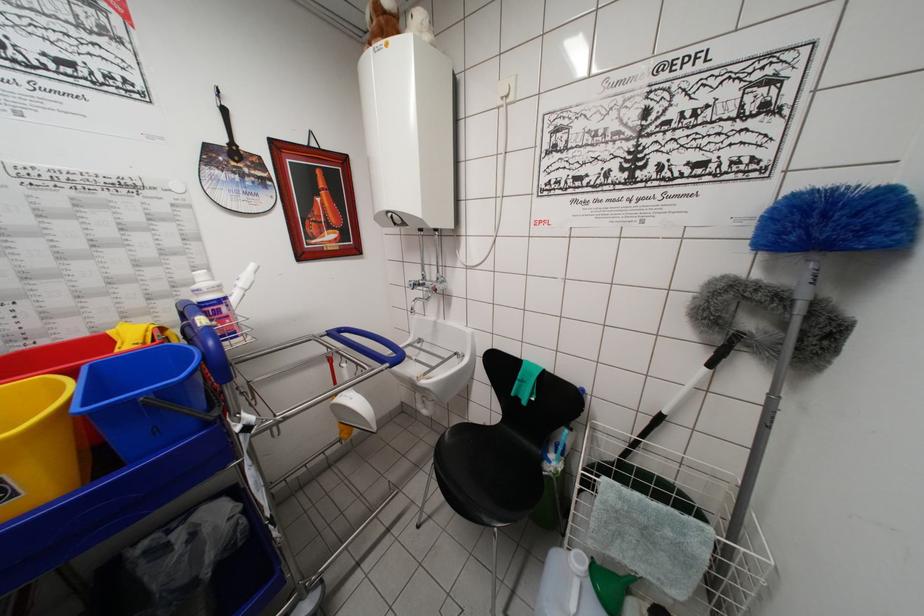
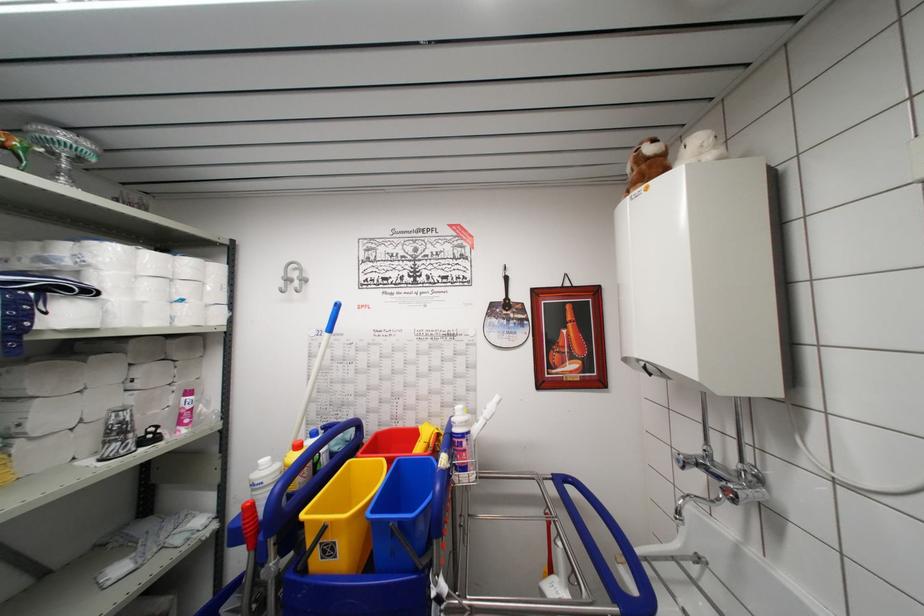
Question: The camera is either moving clockwise (left) or counter-clockwise (right) around the object. The first image is from the beginning of the video and the second image is from the end. Is the camera moving left or right when shooting the video?

Choices:
 (A) Left
 (B) Right

Answer: (B)